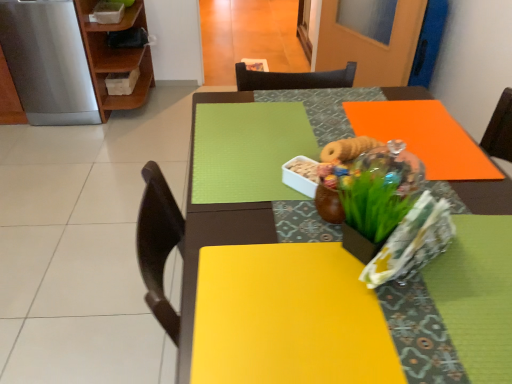
What are the coordinates of `vacant space in front of wooden shelf at upper left` in the screenshot? It's located at (109, 136).